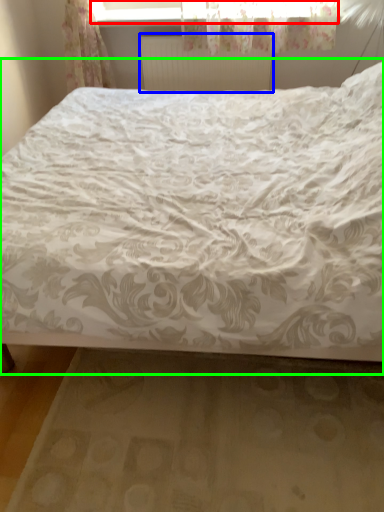
Question: Which object is positioned farthest from window frame (highlighted by a red box)? Select from radiator (highlighted by a blue box) and bed (highlighted by a green box).

Choices:
 (A) radiator
 (B) bed

Answer: (B)